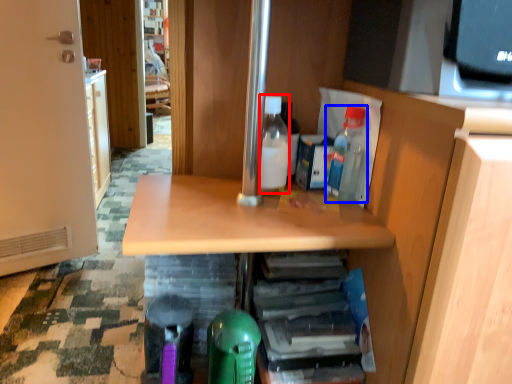
Question: Which point is closer to the camera, bottle (highlighted by a red box) or bottle (highlighted by a blue box)?

Choices:
 (A) bottle
 (B) bottle

Answer: (B)